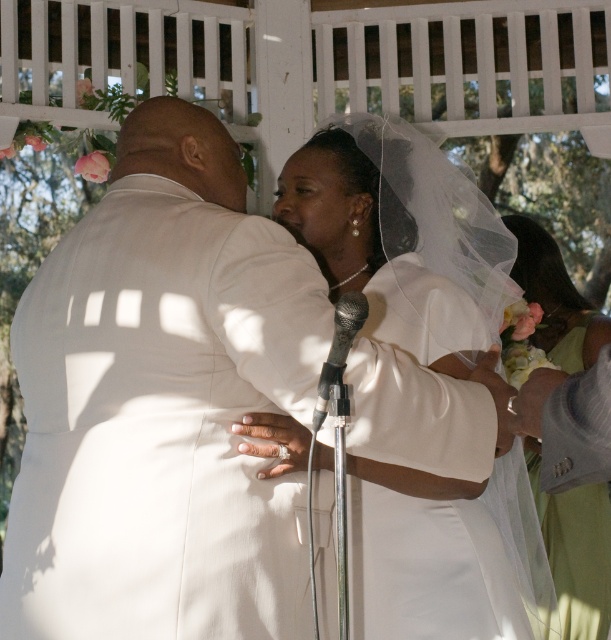
You are a photographer positioned behind the black metallic microphone at center, aiming to capture the couple in the white satin dress at center. Can you see the entire dress without any obstruction from the microphone?

The white satin dress at center is further to the viewer than the black metallic microphone at center, so the microphone is closer to you. This means the microphone may block your view of the dress, making it difficult to capture the entire dress without moving your position.

Consider the image. You are a photographer at the wedding. You need to capture a closeup shot of the white satin dress at center and the white satin veil at right. Which one will be partially out of frame if the camera is focused on the other?

The white satin veil at right will be partially out of frame if the camera is focused on the white satin dress at center because the white satin dress at center is shorter than the white satin veil at right.